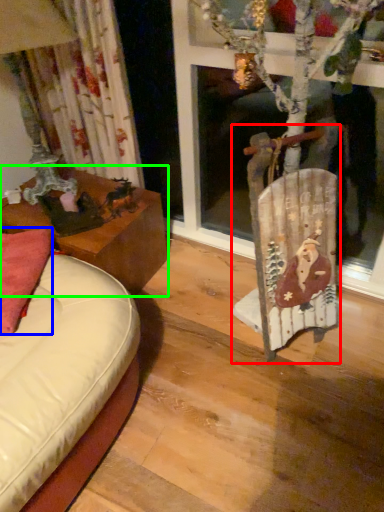
Question: Which is farther away from chair (highlighted by a red box)? pillow (highlighted by a blue box) or table (highlighted by a green box)?

Choices:
 (A) pillow
 (B) table

Answer: (A)